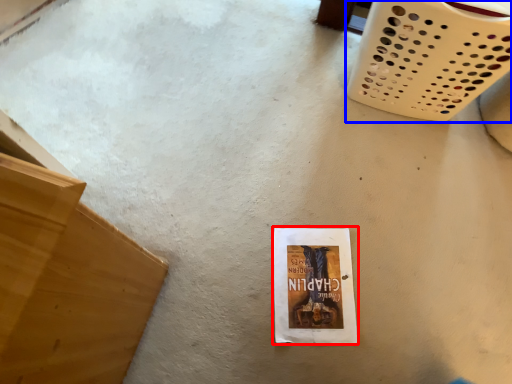
Question: Which object is closer to the camera taking this photo, paperback book (highlighted by a red box) or basket (highlighted by a blue box)?

Choices:
 (A) paperback book
 (B) basket

Answer: (B)